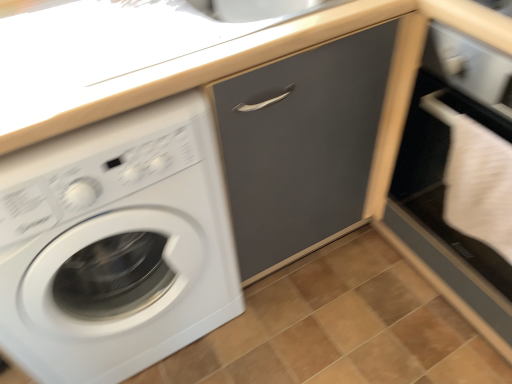
Question: From the image's perspective, would you say matte gray drawer at center is shown under white matte file cabinet at lower right?

Choices:
 (A) no
 (B) yes

Answer: (A)

Question: Considering the relative sizes of matte gray drawer at center and white matte file cabinet at lower right in the image provided, is matte gray drawer at center taller than white matte file cabinet at lower right?

Choices:
 (A) no
 (B) yes

Answer: (B)

Question: Is the position of matte gray drawer at center more distant than that of white matte file cabinet at lower right?

Choices:
 (A) no
 (B) yes

Answer: (B)

Question: Can you confirm if matte gray drawer at center is wider than white matte file cabinet at lower right?

Choices:
 (A) no
 (B) yes

Answer: (A)

Question: Is matte gray drawer at center shorter than white matte file cabinet at lower right?

Choices:
 (A) no
 (B) yes

Answer: (A)

Question: Is point (301, 59) positioned closer to the camera than point (439, 377)?

Choices:
 (A) farther
 (B) closer

Answer: (B)

Question: Is matte gray drawer at center bigger or smaller than brown wooden tile at lower center?

Choices:
 (A) small
 (B) big

Answer: (B)

Question: In the image, is matte gray drawer at center positioned in front of or behind brown wooden tile at lower center?

Choices:
 (A) front
 (B) behind

Answer: (A)

Question: From a real-world perspective, is matte gray drawer at center physically located above or below brown wooden tile at lower center?

Choices:
 (A) below
 (B) above

Answer: (B)

Question: In terms of width, does white glossy washing machine at left look wider or thinner when compared to brown wooden tile at lower center?

Choices:
 (A) wide
 (B) thin

Answer: (B)

Question: Based on their sizes in the image, would you say white glossy washing machine at left is bigger or smaller than brown wooden tile at lower center?

Choices:
 (A) big
 (B) small

Answer: (A)

Question: Does point (176, 286) appear closer or farther from the camera than point (305, 274)?

Choices:
 (A) farther
 (B) closer

Answer: (B)

Question: From the image's perspective, is white glossy washing machine at left located above or below brown wooden tile at lower center?

Choices:
 (A) below
 (B) above

Answer: (B)

Question: From a real-world perspective, is brown wooden tile at lower center physically located above or below white glossy washing machine at left?

Choices:
 (A) above
 (B) below

Answer: (B)

Question: Is brown wooden tile at lower center taller or shorter than white glossy washing machine at left?

Choices:
 (A) short
 (B) tall

Answer: (A)